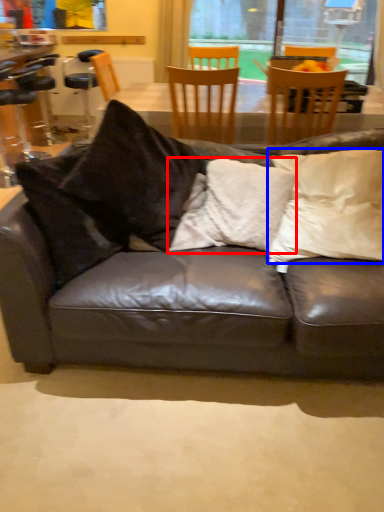
Question: Which object is further to the camera taking this photo, pillow (highlighted by a red box) or pillow (highlighted by a blue box)?

Choices:
 (A) pillow
 (B) pillow

Answer: (A)